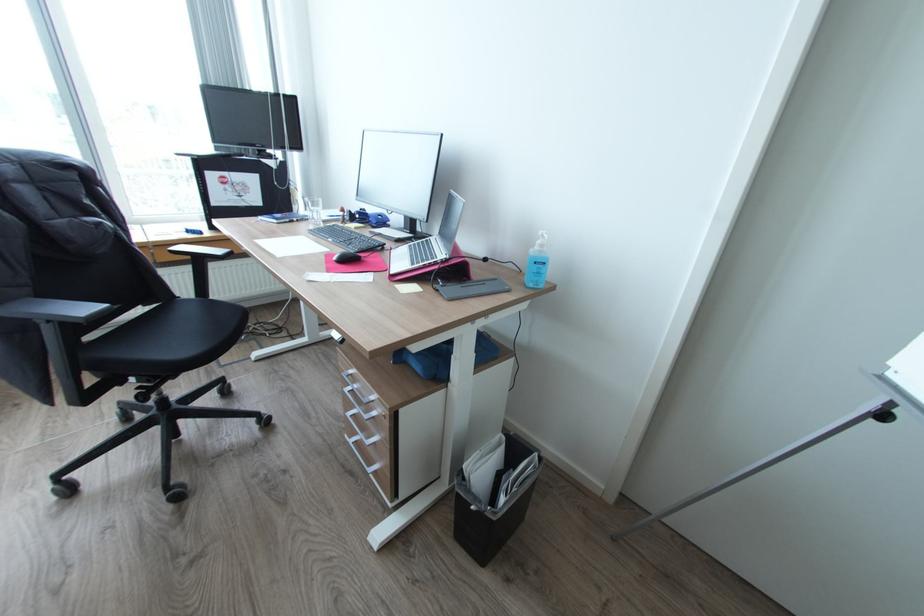
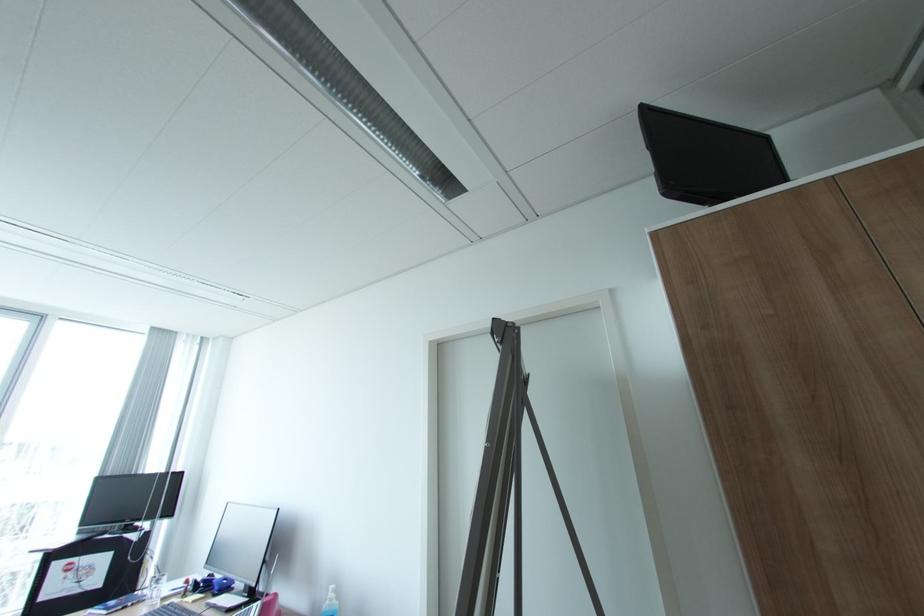
Where in the second image is the point corresponding to pixel 545 245 from the first image?

(336, 599)